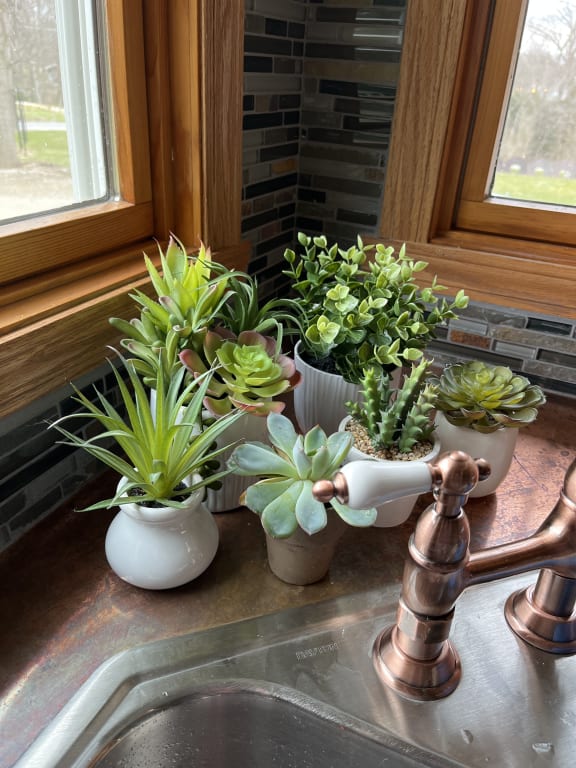
The width and height of the screenshot is (576, 768). I want to click on the right window, so click(532, 181).